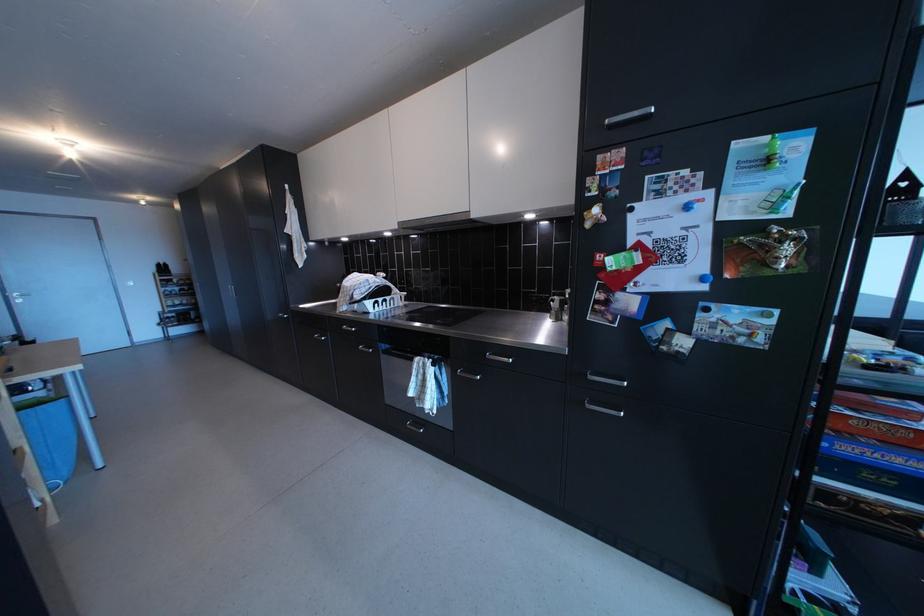
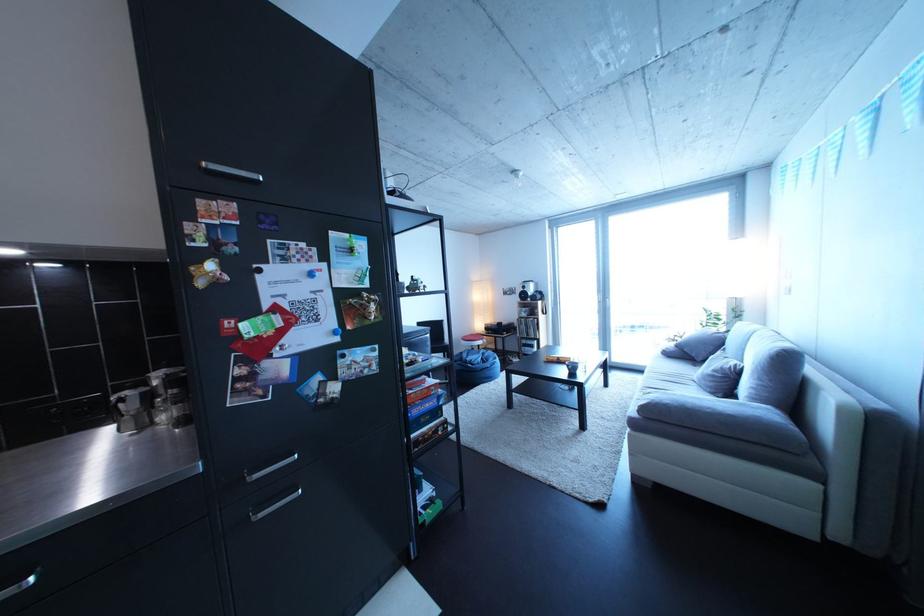
The point at (569, 304) is marked in the first image. Where is the corresponding point in the second image?

(140, 399)